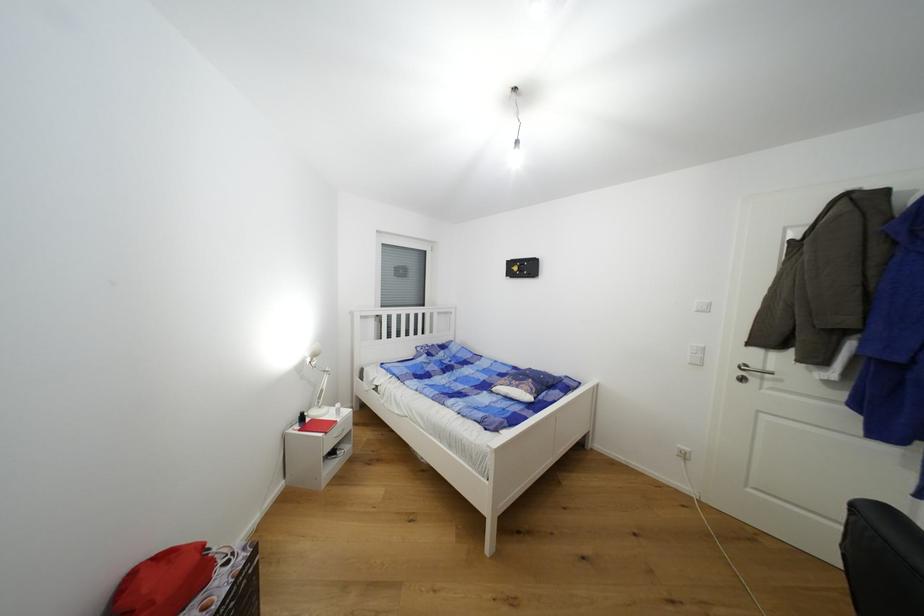
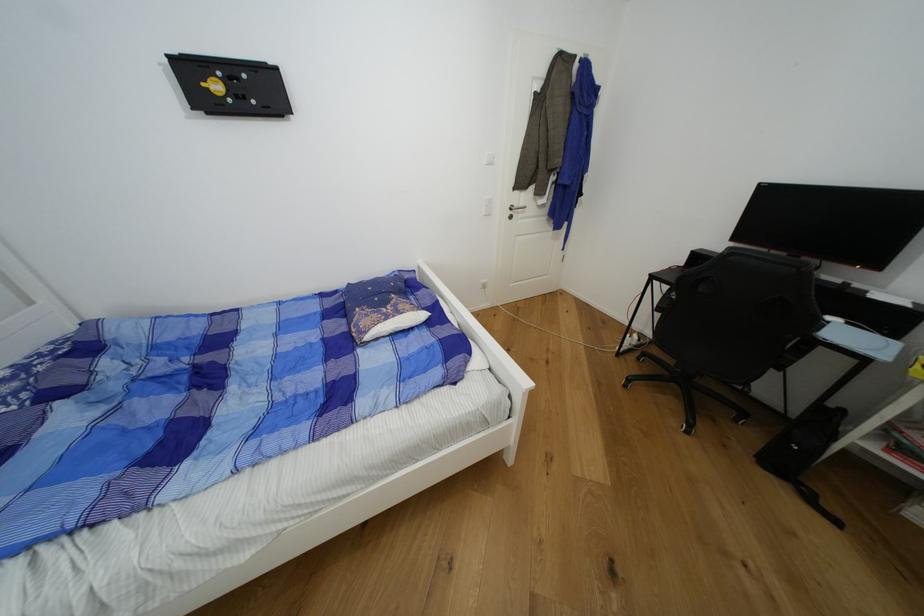
Locate, in the second image, the point that corresponds to pixel 760 368 in the first image.

(521, 207)